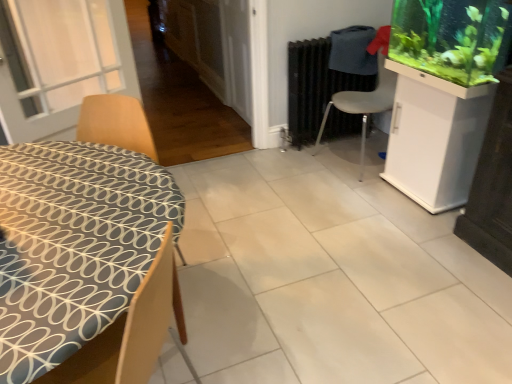
Question: From the image's perspective, is black matte radiator at center above or below white plastic chair at center-right, the 2th chair viewed from the front?

Choices:
 (A) above
 (B) below

Answer: (A)

Question: From a real-world perspective, is black matte radiator at center physically located above or below white plastic chair at center-right, the 2th chair viewed from the front?

Choices:
 (A) above
 (B) below

Answer: (B)

Question: Based on their relative distances, which object is nearer to the white glossy cabinet at right?

Choices:
 (A) green matte aquarium at upper right
 (B) white glossy tile at center
 (C) wooden chair at left, which is counted as the 2th chair, starting from the back
 (D) white plastic chair at center-right, the 1th chair viewed from the back
 (E) black matte radiator at center

Answer: (A)

Question: Considering the real-world distances, which object is farthest from the wooden chair at left, the first chair positioned from the front?

Choices:
 (A) white glossy cabinet at right
 (B) green matte aquarium at upper right
 (C) black matte radiator at center
 (D) white glossy tile at center
 (E) white plastic chair at center-right, the first chair viewed from the right

Answer: (E)